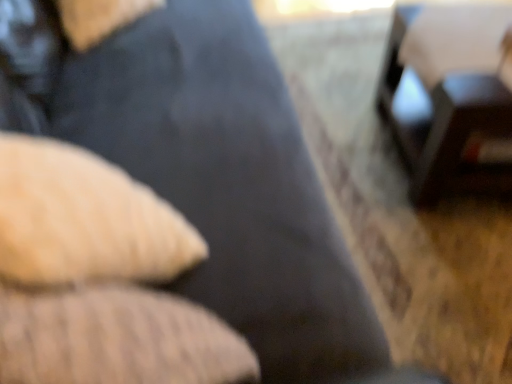
This screenshot has width=512, height=384. I want to click on matte black tv at upper right, so click(444, 124).

What do you see at coordinates (444, 124) in the screenshot? This screenshot has height=384, width=512. I see `matte black tv at upper right` at bounding box center [444, 124].

Find the location of `matte black tv at upper right`. matte black tv at upper right is located at coordinates (444, 124).